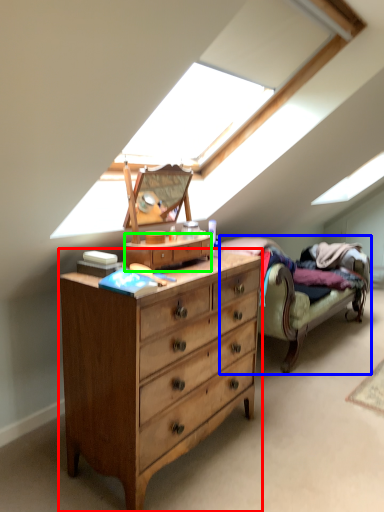
Question: Estimate the real-world distances between objects in this image. Which object is farther from chest of drawers (highlighted by a red box), studio couch (highlighted by a blue box) or file cabinet (highlighted by a green box)?

Choices:
 (A) studio couch
 (B) file cabinet

Answer: (A)